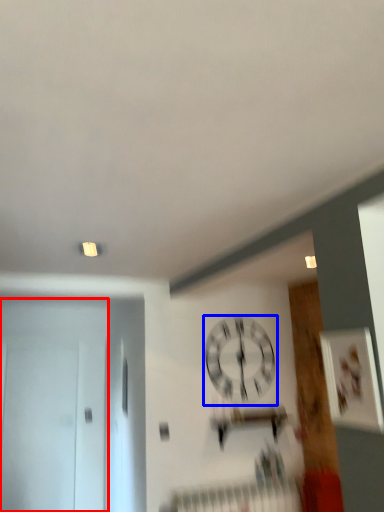
Question: Which point is further to the camera, door (highlighted by a red box) or wall clock (highlighted by a blue box)?

Choices:
 (A) door
 (B) wall clock

Answer: (A)